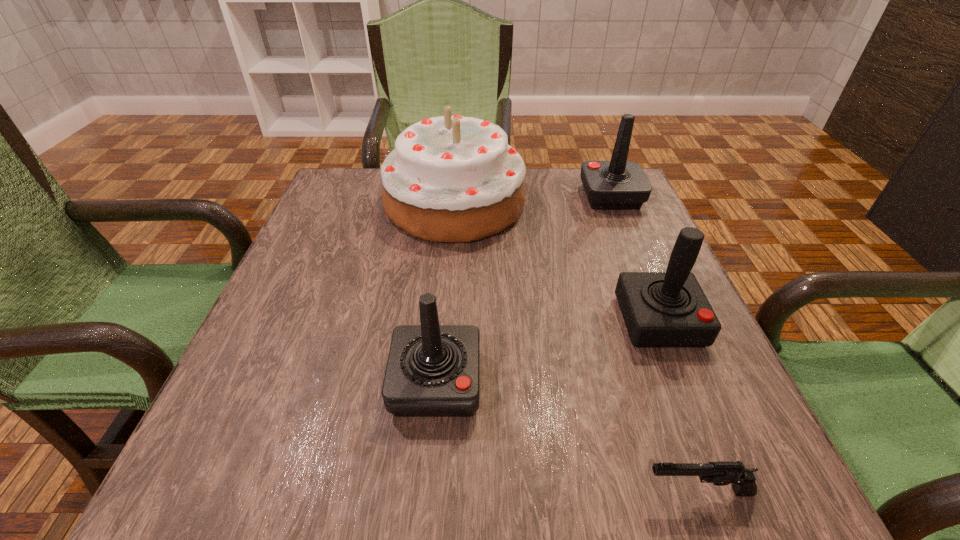
The image size is (960, 540). What are the coordinates of `cake` in the screenshot? It's located at (450, 178).

In order to click on the farthest joystick in this screenshot , I will do `click(618, 184)`.

This screenshot has width=960, height=540. Find the location of `the leftmost joystick`. the leftmost joystick is located at coordinates (432, 370).

Image resolution: width=960 pixels, height=540 pixels. What are the coordinates of `gun` in the screenshot? It's located at (721, 473).

Locate an element on the screen. This screenshot has width=960, height=540. the nearest object is located at coordinates (721, 473).

Identify the location of vacant space situated on the right of the cake. (590, 203).

Locate an element on the screen. blank area located on the front of the farthest joystick is located at coordinates (636, 259).

Find the location of a particular element. Image resolution: width=960 pixels, height=540 pixels. free space located on the front-facing side of the leftmost joystick is located at coordinates (426, 496).

Where is `free space located at the end of the barrel of the gun`? Image resolution: width=960 pixels, height=540 pixels. free space located at the end of the barrel of the gun is located at coordinates (546, 491).

Find the location of `vacant space located 0.090m at the end of the barrel of the gun`. vacant space located 0.090m at the end of the barrel of the gun is located at coordinates (576, 491).